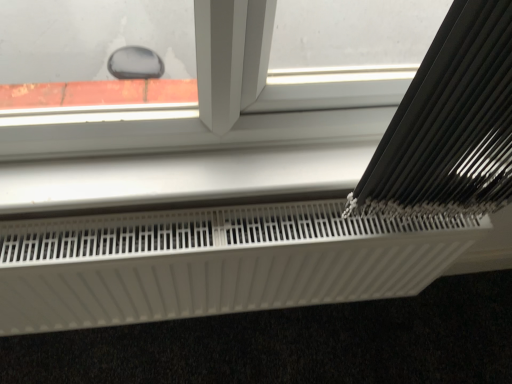
Where is `free point above white matte radiator at lower center (from a real-world perspective)`? The height and width of the screenshot is (384, 512). free point above white matte radiator at lower center (from a real-world perspective) is located at coordinates (215, 226).